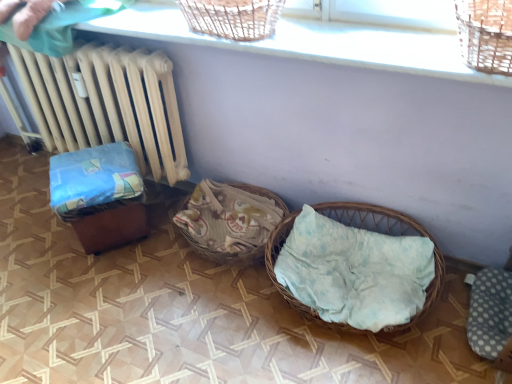
Question: Is woven wicker basket at lower right wider or thinner than woven wood basket at upper center?

Choices:
 (A) thin
 (B) wide

Answer: (B)

Question: Considering the positions of point (340, 203) and point (141, 4), is point (340, 203) closer or farther from the camera than point (141, 4)?

Choices:
 (A) closer
 (B) farther

Answer: (B)

Question: Based on their relative distances, which object is nearer to the woven fabric basket at center?

Choices:
 (A) beige wood radiator at left
 (B) woven wood basket at upper center
 (C) woven wicker basket at lower right
 (D) wooden brown baby carriage at left
 (E) gray dotted fabric at lower right

Answer: (C)

Question: Estimate the real-world distances between objects in this image. Which object is farther from the woven wicker basket at lower right?

Choices:
 (A) woven fabric basket at center
 (B) beige wood radiator at left
 (C) woven wood basket at upper center
 (D) gray dotted fabric at lower right
 (E) wooden brown baby carriage at left

Answer: (B)